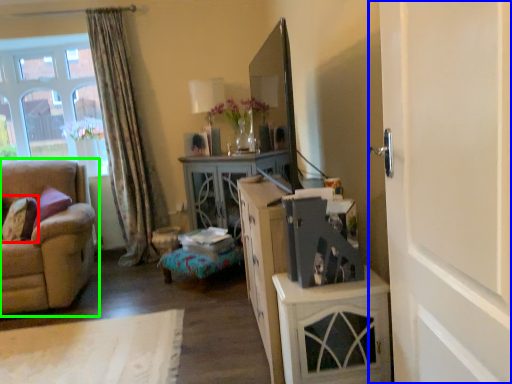
Question: Based on their relative distances, which object is nearer to pillow (highlighted by a red box)? Choose from door (highlighted by a blue box) and studio couch (highlighted by a green box).

Choices:
 (A) door
 (B) studio couch

Answer: (B)